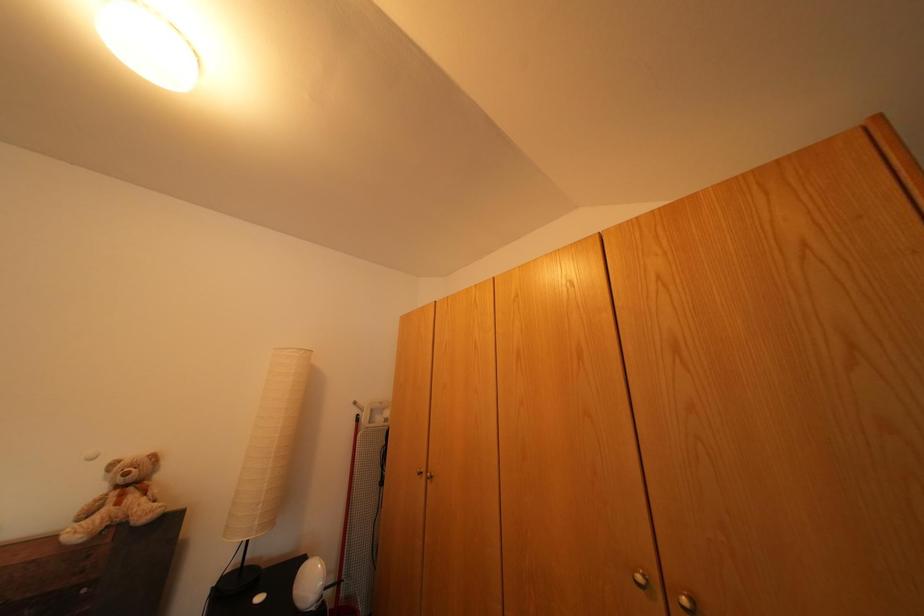
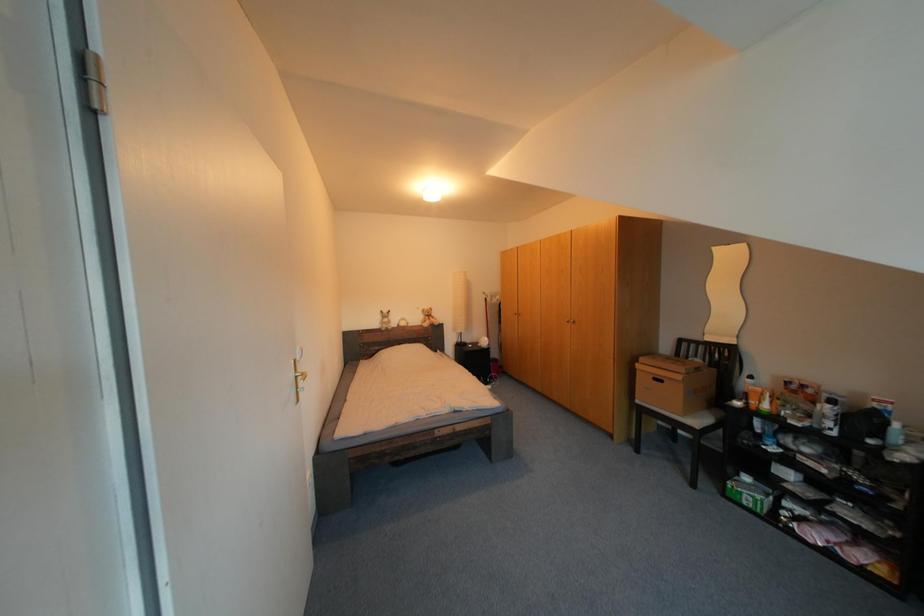
Question: In a continuous first-person perspective shot, in which direction is the camera moving?

Choices:
 (A) Left
 (B) Right
 (C) Forward
 (D) Backward

Answer: (D)